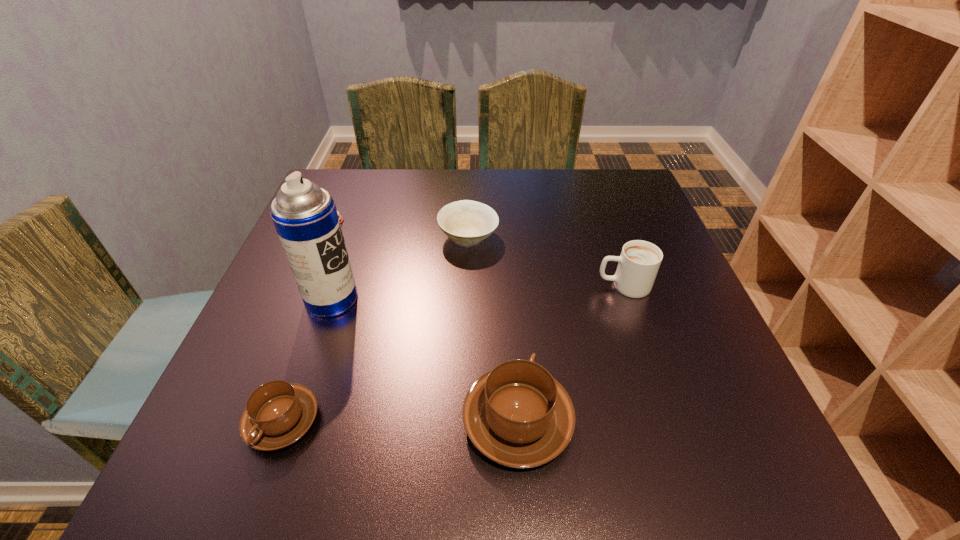
Identify which object is the second closest to the shortest cappuccino. Please provide its 2D coordinates. Your answer should be formatted as a tuple, i.e. [(x, y)], where the tuple contains the x and y coordinates of a point satisfying the conditions above.

[(517, 415)]

The height and width of the screenshot is (540, 960). I want to click on the closest cappuccino to the shortest cappuccino, so click(517, 415).

Point out which cappuccino is positioned as the nearest to the shortest cappuccino. Please provide its 2D coordinates. Your answer should be formatted as a tuple, i.e. [(x, y)], where the tuple contains the x and y coordinates of a point satisfying the conditions above.

[(517, 415)]

I want to click on free space that satisfies the following two spatial constraints: 1. on the side with the handle of the rightmost cappuccino; 2. on the side of the shortest cappuccino with the handle, so click(x=669, y=421).